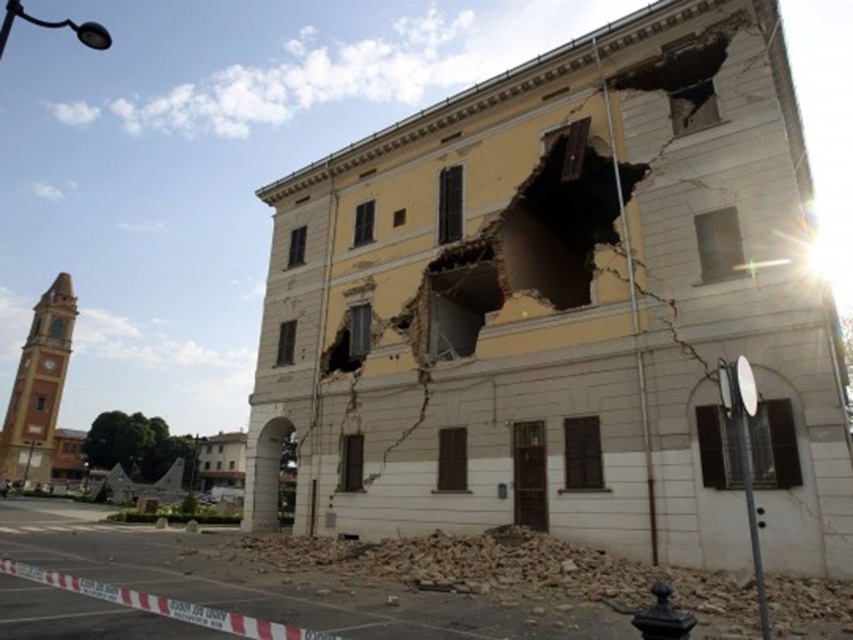
You are standing at the scene of a building collapse. There is a point marked at coordinates point (740,480). If you want to safely observe the structural damage without crossing the red and white striped barrier tape, can you see the point from your current position?

The point (740,480) is 11.91 meters from viewer, so yes, you can see the point from your current position as it is within visible range and not obstructed by the barrier tape.

Looking at this image, you are a construction worker assessing the damage to the building. You notice the yellow plaster wall at center and the broken concrete rubble at lower center. Which object takes up more space in the image?

The yellow plaster wall at center is larger in size than the broken concrete rubble at lower center, so it takes up more space in the image.

You are a construction worker assessing the damage to the building. You notice the yellow plaster wall at center and the broken concrete rubble at lower center. Which object is taller?

The yellow plaster wall at center is much taller than the broken concrete rubble at lower center according to the description.